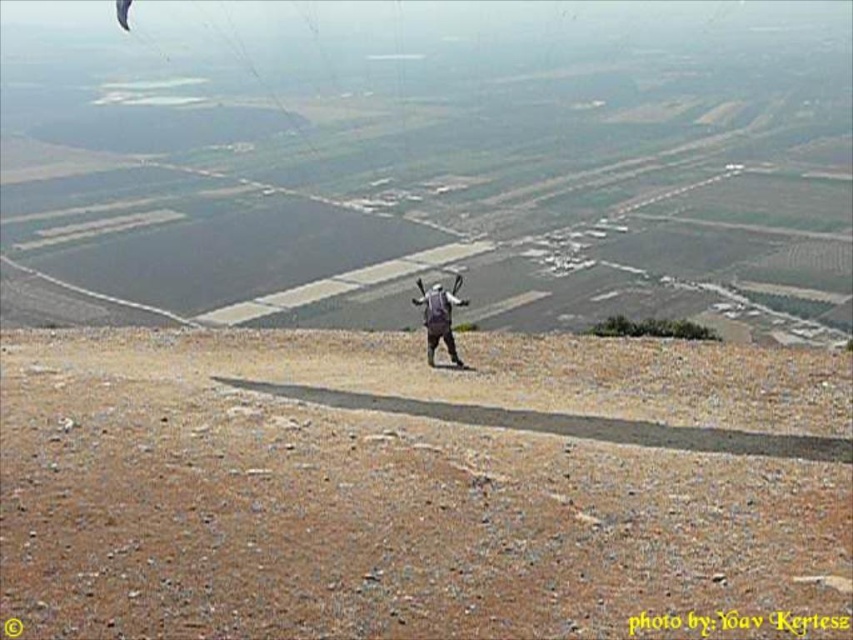
You are a drone operator flying a drone over a rugged rocky terrain. You need to land the drone on the brown gravel at center. The drone has a GPS coordinate system where the bottom left corner is the origin point. The point representing the brown gravel at center is located at coordinates point (409, 484). What are the coordinates of the landing zone?

The coordinates of the landing zone are point (409, 484).

You are a hiker who wants to place a small flag on the highest point between the brown gravel at center and the matte gray backpack at center. Which object should you place the flag on?

The matte gray backpack at center is taller than the brown gravel at center, so you should place the flag on the matte gray backpack at center.

You are a hiker who just arrived at the rocky terrain. You see the brown gravel at center and the matte gray backpack at center. Which object is located to the right of the other?

The brown gravel at center is positioned on the right side of matte gray backpack at center.